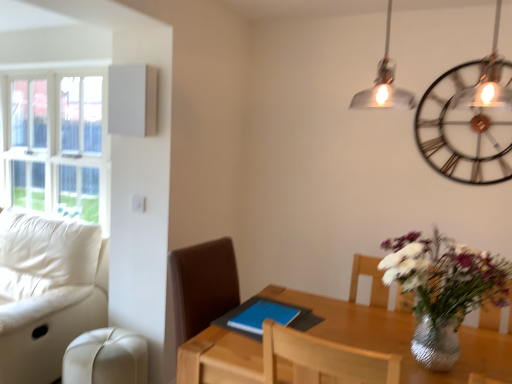
Where is `empty space that is ontop of blue matte tablet at center (from a real-world perspective)`? The image size is (512, 384). empty space that is ontop of blue matte tablet at center (from a real-world perspective) is located at coordinates (266, 316).